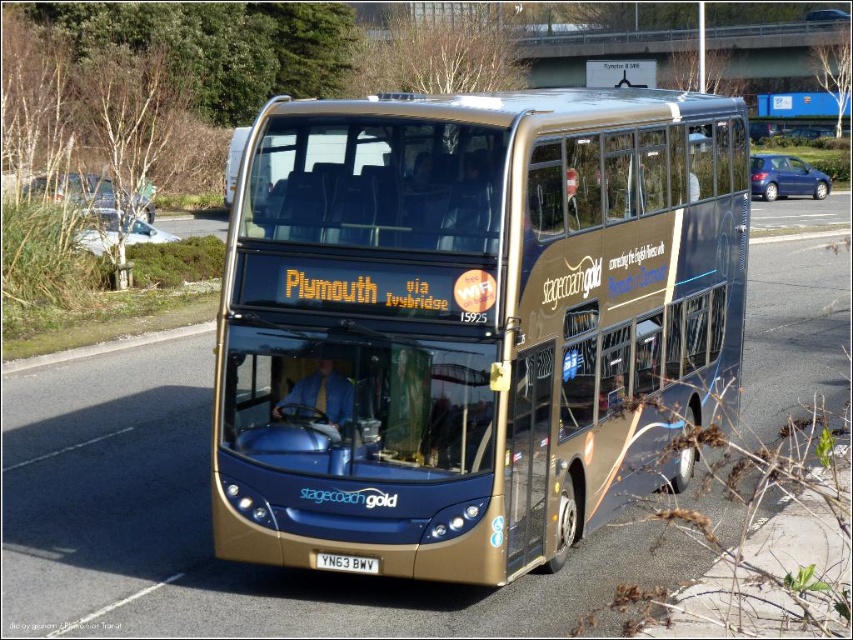
You are a pedestrian standing on the roadside and see the gold metallic bus at center and the red metallic license plate at center. Which object is higher in the image?

The gold metallic bus at center is higher than the red metallic license plate at center.

You are a pedestrian standing on the sidewalk and see the gold metallic bus at center and the red metallic license plate at center. Which object is closer to your left side?

The gold metallic bus at center is positioned on the left side of the red metallic license plate at center, so it is closer to your left side.